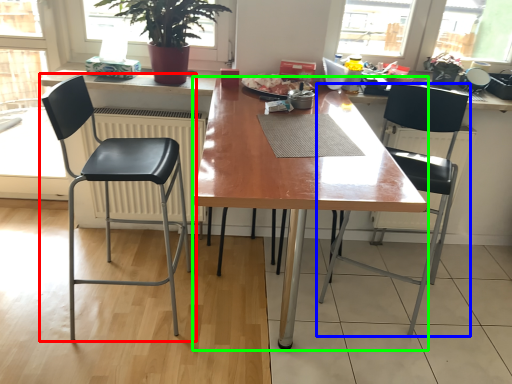
Question: Based on their relative distances, which object is farther from chair (highlighted by a red box)? Choose from chair (highlighted by a blue box) and desk (highlighted by a green box).

Choices:
 (A) chair
 (B) desk

Answer: (A)